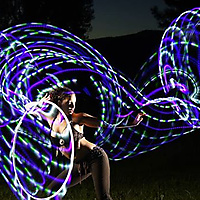
At what (x,y) coordinates should I click in order to perform the action: click on white neon lights all across middle of picture. Please return your answer as a coordinate pair (x, y). Looking at the image, I should click on (13, 135), (67, 120), (158, 98), (124, 78), (19, 84), (187, 108).